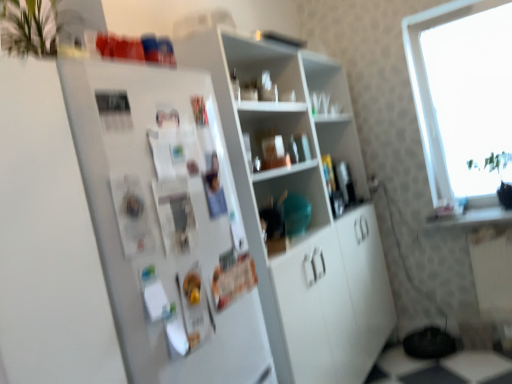
Question: Based on their positions, is transparent glass window at upper right located to the left or right of white glossy cabinet at center, which appears as the third shelf when viewed from the top?

Choices:
 (A) left
 (B) right

Answer: (B)

Question: From a real-world perspective, is transparent glass window at upper right positioned above or below white glossy cabinet at center, which appears as the third shelf when viewed from the top?

Choices:
 (A) above
 (B) below

Answer: (A)

Question: Considering the real-world distances, which object is farthest from the matte plastic bowl at center, which is the 2th shelf in top-to-bottom order?

Choices:
 (A) matte plastic bottles at center, arranged as the third shelf when ordered from the bottom
 (B) white matte refrigerator at left
 (C) white glossy cabinet at center, which appears as the third shelf when viewed from the top
 (D) transparent glass window at upper right

Answer: (D)

Question: Which of these objects is positioned closest to the transparent glass window at upper right?

Choices:
 (A) matte plastic bowl at center, which is the 2th shelf in top-to-bottom order
 (B) white glossy cabinet at center, the first shelf ordered from the bottom
 (C) white matte refrigerator at left
 (D) matte plastic bottles at center, the 1th shelf positioned from the top

Answer: (D)